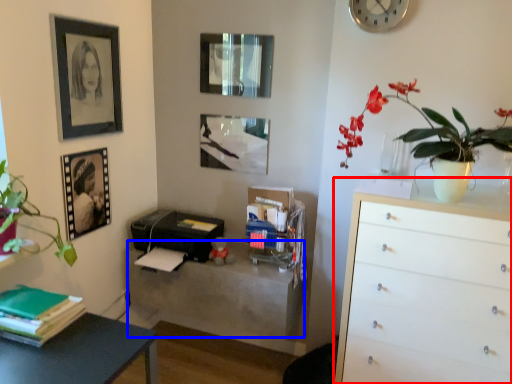
Question: Among these objects, which one is farthest to the camera, chest of drawers (highlighted by a red box) or table (highlighted by a blue box)?

Choices:
 (A) chest of drawers
 (B) table

Answer: (B)